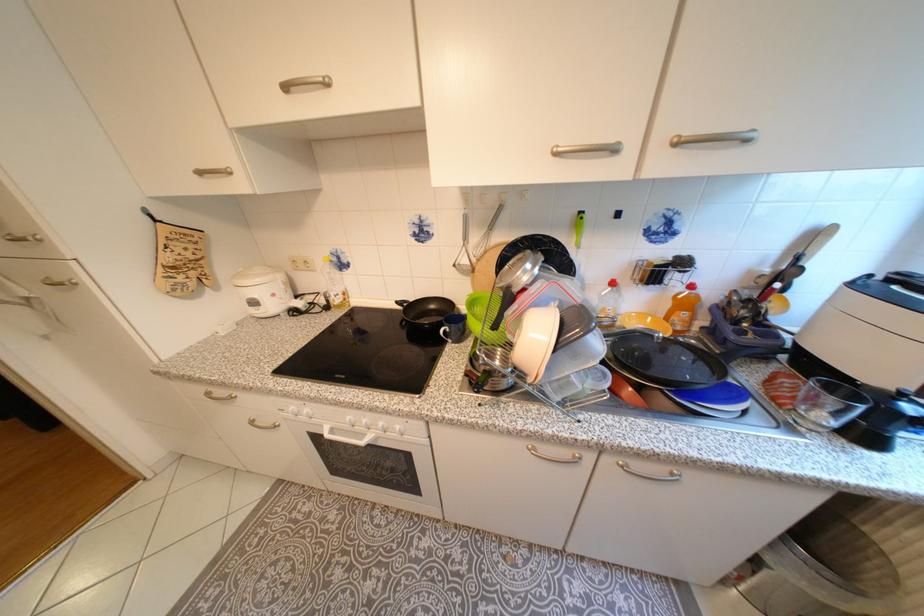
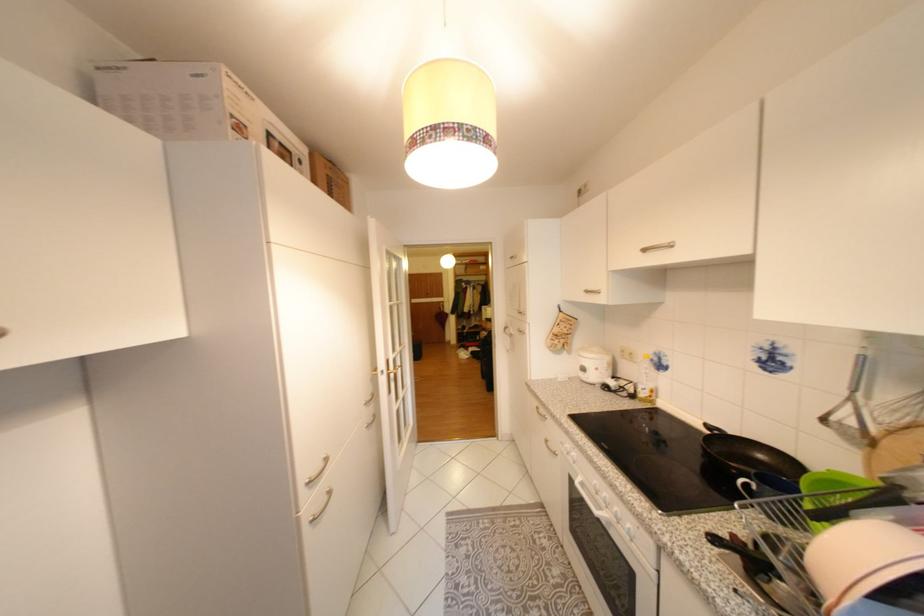
In the second image, find the point that corresponds to [345,302] in the first image.

(651, 395)